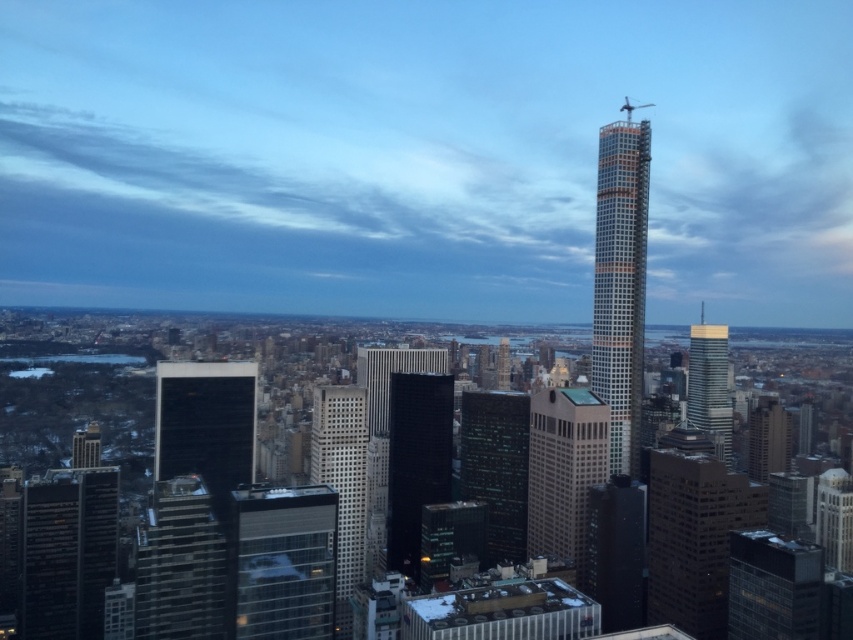
Can you confirm if orange brick building at right is shorter than dark glass skyscraper at lower left?

No.

Can you confirm if orange brick building at right is smaller than dark glass skyscraper at lower left?

Incorrect, orange brick building at right is not smaller in size than dark glass skyscraper at lower left.

Identify the location of orange brick building at right. click(619, 282).

I want to click on orange brick building at right, so click(x=619, y=282).

Looking at this image, between orange brick building at right and glassy reflective skyscraper at center, which one has less height?

With less height is glassy reflective skyscraper at center.

Is orange brick building at right above glassy reflective skyscraper at center?

Yes, orange brick building at right is above glassy reflective skyscraper at center.

Which is behind, point (612, 166) or point (305, 611)?

The point (612, 166) is more distant.

The width and height of the screenshot is (853, 640). What are the coordinates of `orange brick building at right` in the screenshot? It's located at (619, 282).

Which of these two, dark gray concrete skyscraper at center-left or dark glass skyscraper at center, stands shorter?

dark glass skyscraper at center is shorter.

Does point (209, 550) come farther from viewer compared to point (187, 460)?

No, it is not.

Identify the location of dark gray concrete skyscraper at center-left. The width and height of the screenshot is (853, 640). (180, 564).